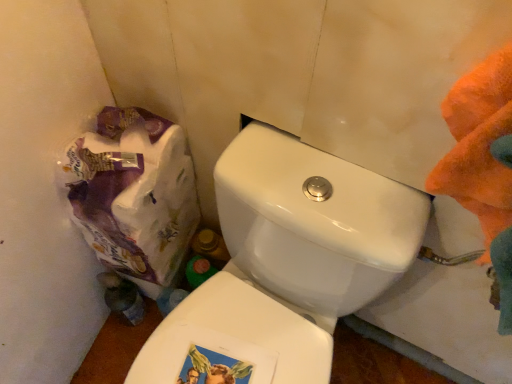
Question: From the image's perspective, is white glossy toilet at center positioned above or below white paper bag at lower left?

Choices:
 (A) below
 (B) above

Answer: (A)

Question: From their relative heights in the image, would you say white glossy toilet at center is taller or shorter than white paper bag at lower left?

Choices:
 (A) tall
 (B) short

Answer: (A)

Question: Considering the positions of white glossy toilet at center and white paper bag at lower left in the image, is white glossy toilet at center bigger or smaller than white paper bag at lower left?

Choices:
 (A) small
 (B) big

Answer: (B)

Question: Is white paper bag at lower left wider or thinner than white glossy toilet at center?

Choices:
 (A) thin
 (B) wide

Answer: (A)

Question: Is white paper bag at lower left in front of or behind white glossy toilet at center in the image?

Choices:
 (A) behind
 (B) front

Answer: (A)

Question: Does point (150, 261) appear closer or farther from the camera than point (329, 349)?

Choices:
 (A) closer
 (B) farther

Answer: (B)

Question: From the image's perspective, is white paper bag at lower left positioned above or below white glossy toilet at center?

Choices:
 (A) below
 (B) above

Answer: (B)